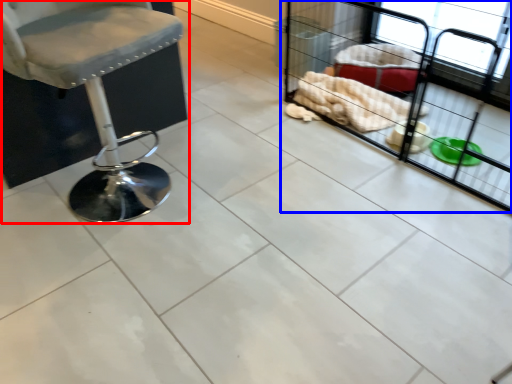
Question: Which object appears farthest to the camera in this image, chair (highlighted by a red box) or baby carriage (highlighted by a blue box)?

Choices:
 (A) chair
 (B) baby carriage

Answer: (B)